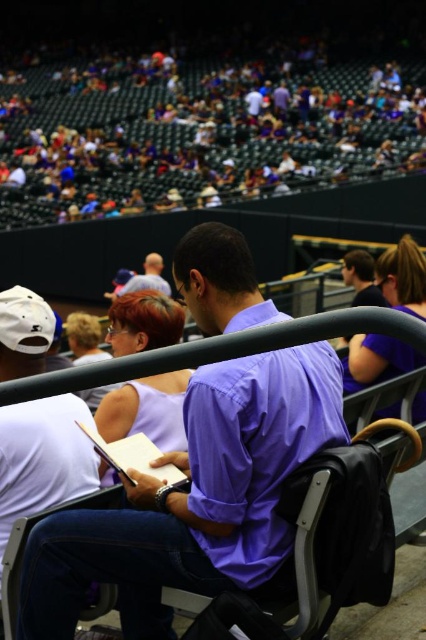
Is purple fabric shirt at upper right thinner than black plastic chair at center?

Correct, purple fabric shirt at upper right's width is less than black plastic chair at center's.

Who is taller, purple fabric shirt at upper right or black plastic chair at center?

With more height is black plastic chair at center.

Does point (414, 296) come farther from viewer compared to point (71, 508)?

Yes, point (414, 296) is behind point (71, 508).

Find the location of a particular element. purple fabric shirt at upper right is located at coordinates (403, 276).

Does matte purple shirt at center appear over purple cotton shirt at center?

Indeed, matte purple shirt at center is positioned over purple cotton shirt at center.

Is matte purple shirt at center bigger than purple cotton shirt at center?

Correct, matte purple shirt at center is larger in size than purple cotton shirt at center.

You are a GUI agent. You are given a task and a screenshot of the screen. Output one action in this format:
    pyautogui.click(x=<x>, y=<y>)
    Task: Click on the matte purple shirt at center
    
    Given the screenshot: What is the action you would take?
    pyautogui.click(x=199, y=132)

In the scene shown: Who is lower down, matte purple shirt at center or purple fabric shirt at upper right?

Positioned lower is purple fabric shirt at upper right.

Can you confirm if matte purple shirt at center is bigger than purple fabric shirt at upper right?

Correct, matte purple shirt at center is larger in size than purple fabric shirt at upper right.

What do you see at coordinates (199, 132) in the screenshot?
I see `matte purple shirt at center` at bounding box center [199, 132].

Image resolution: width=426 pixels, height=640 pixels. In order to click on matte purple shirt at center in this screenshot , I will do `click(199, 132)`.